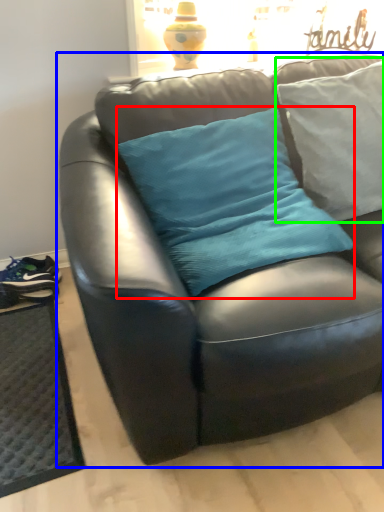
Question: Considering the real-world distances, which object is closest to pillow (highlighted by a red box)? studio couch (highlighted by a blue box) or pillow (highlighted by a green box).

Choices:
 (A) studio couch
 (B) pillow

Answer: (A)